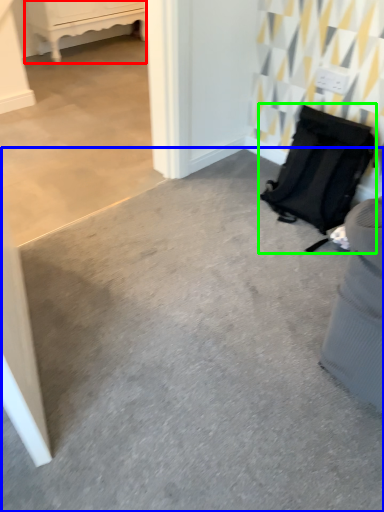
Question: Considering the real-world distances, which object is closest to furniture (highlighted by a red box)? concrete (highlighted by a blue box) or luggage and bags (highlighted by a green box).

Choices:
 (A) concrete
 (B) luggage and bags

Answer: (B)